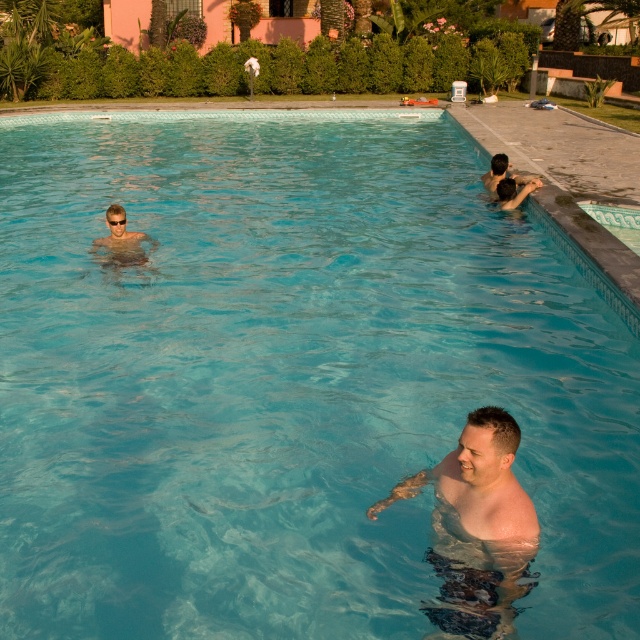
From the picture: You are a photographer standing at the edge of the pool. You want to take a photo that includes both the shiny skin man at center and the transparent plastic goggles at upper left. Which object should be placed closer to the camera to ensure both are in focus?

The shiny skin man at center is taller than the transparent plastic goggles at upper left, so to ensure both are in focus, the transparent plastic goggles at upper left should be placed closer to the camera.

You are a lifeguard standing at the edge of the pool. You need to retrieve the transparent plastic goggles at upper left and give them to the shiny skin man at center. Can you reach them without leaving your position?

The shiny skin man at center and transparent plastic goggles at upper left are 6.01 meters apart from each other. Since you are at the edge where the goggles are, you can hand them to the man if he can reach that distance, but since you can only extend your arm about 2 meters, he needs to come closer.